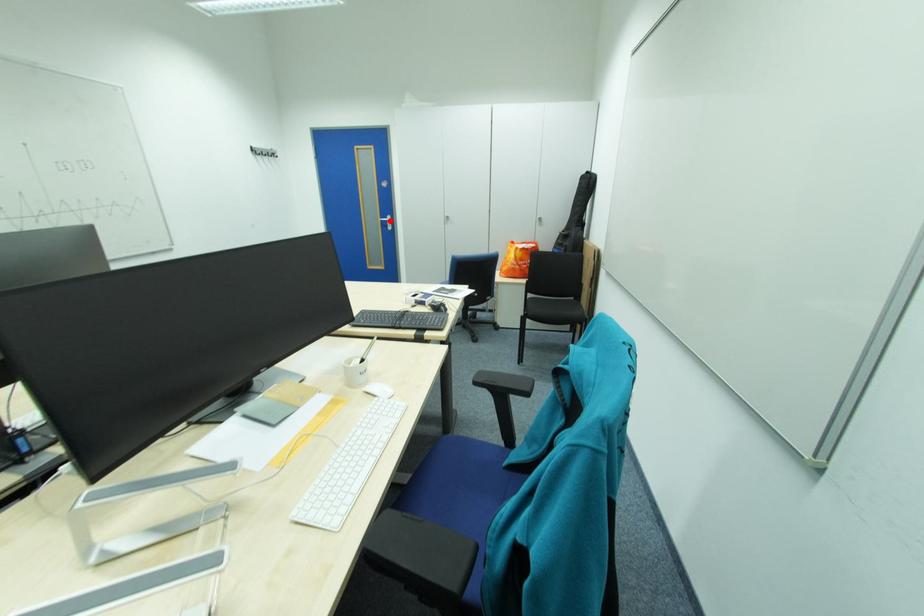
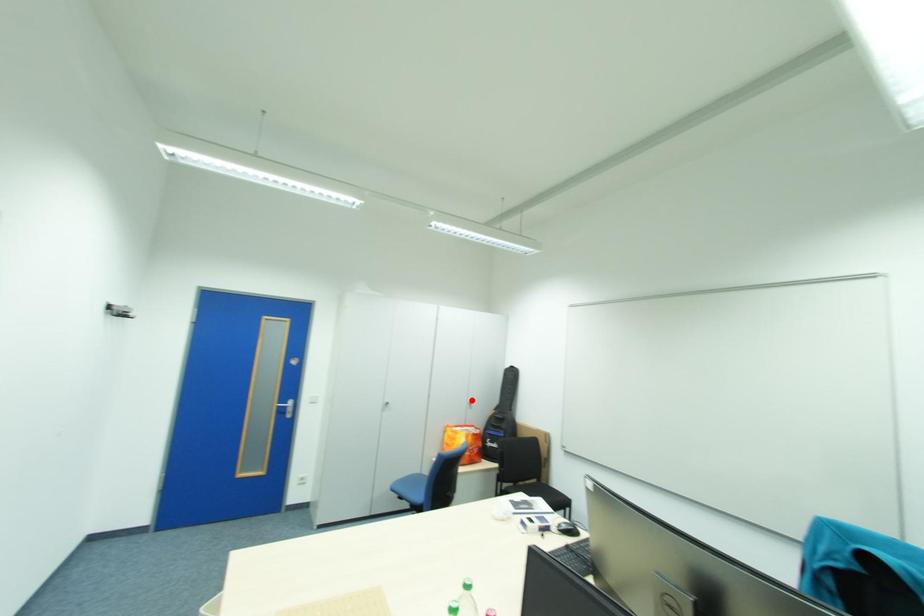
I am providing you with two images of the same scene from different viewpoints. A red point is marked on the first image and another point is marked on the second image. Do the highlighted points in image1 and image2 indicate the same real-world spot?

No